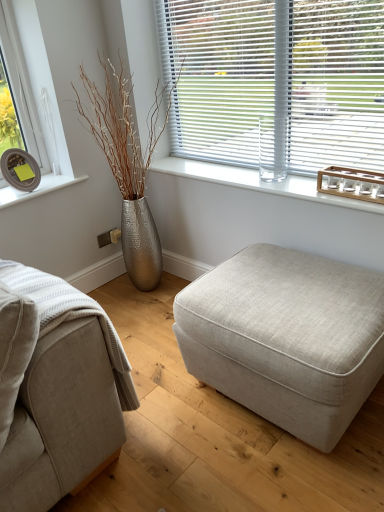
Question: Should I look upward or downward to see clear glass at upper center?

Choices:
 (A) down
 (B) up

Answer: (B)

Question: Is beige fabric ottoman at center beside silver textured vase at left?

Choices:
 (A) yes
 (B) no

Answer: (B)

Question: From the image's perspective, is beige fabric ottoman at center above silver textured vase at left?

Choices:
 (A) yes
 (B) no

Answer: (B)

Question: Can you confirm if beige fabric ottoman at center is taller than silver textured vase at left?

Choices:
 (A) no
 (B) yes

Answer: (A)

Question: Considering the relative sizes of beige fabric ottoman at center and silver textured vase at left in the image provided, is beige fabric ottoman at center wider than silver textured vase at left?

Choices:
 (A) no
 (B) yes

Answer: (B)

Question: Does beige fabric ottoman at center have a larger size compared to silver textured vase at left?

Choices:
 (A) no
 (B) yes

Answer: (A)

Question: Would you say beige fabric ottoman at center contains silver textured vase at left?

Choices:
 (A) no
 (B) yes

Answer: (A)

Question: Can you confirm if clear glass at upper center is bigger than beige fabric ottoman at center?

Choices:
 (A) no
 (B) yes

Answer: (A)

Question: Does clear glass at upper center have a greater height compared to beige fabric ottoman at center?

Choices:
 (A) no
 (B) yes

Answer: (A)

Question: Is clear glass at upper center placed right next to beige fabric ottoman at center?

Choices:
 (A) no
 (B) yes

Answer: (A)

Question: Is clear glass at upper center facing towards beige fabric ottoman at center?

Choices:
 (A) yes
 (B) no

Answer: (B)

Question: Does clear glass at upper center lie behind beige fabric ottoman at center?

Choices:
 (A) no
 (B) yes

Answer: (B)

Question: From the image's perspective, is clear glass at upper center above beige fabric ottoman at center?

Choices:
 (A) no
 (B) yes

Answer: (B)

Question: Is the depth of beige fabric couch at lower left greater than that of beige fabric ottoman at center?

Choices:
 (A) no
 (B) yes

Answer: (A)